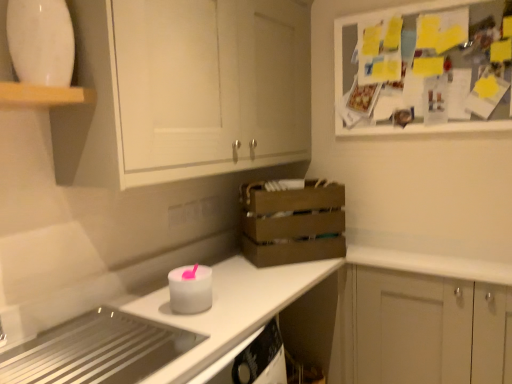
Locate an element on the screen. This screenshot has height=384, width=512. free point above white glossy countertop at lower left (from a real-world perspective) is located at coordinates (252, 270).